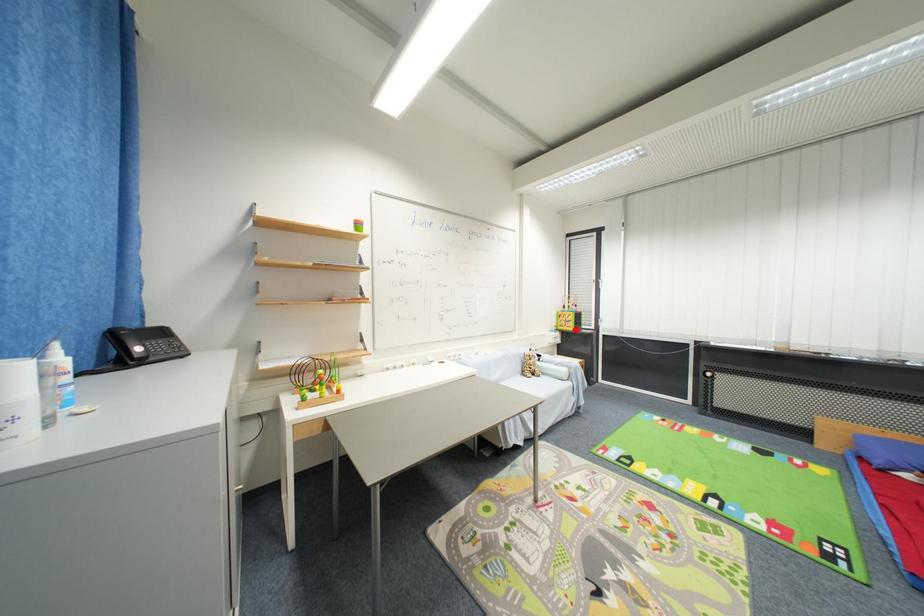
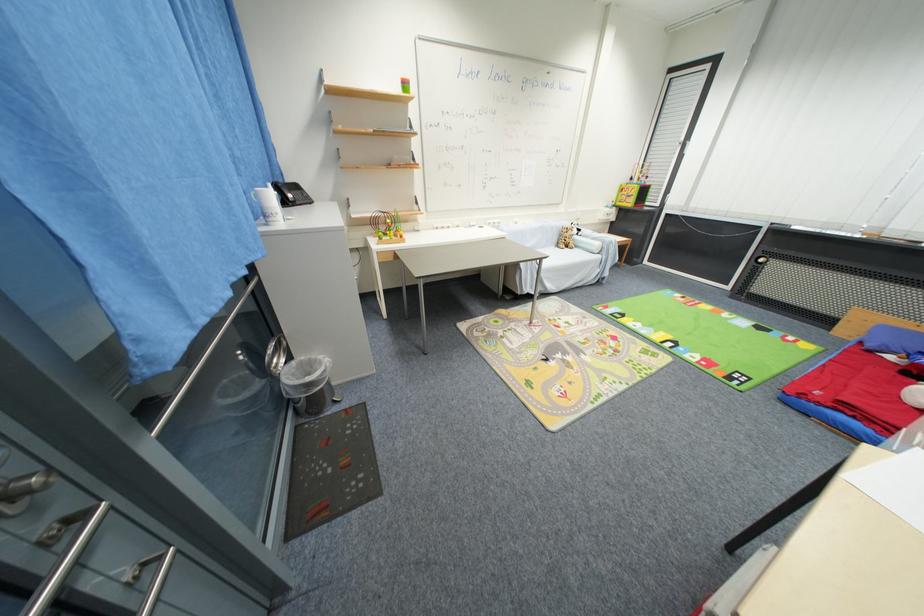
Question: I am providing you with two images of the same scene from different viewpoints. A red point is marked on the first image. At the location where the point appears in image 1, is it still visible in image 2?

Choices:
 (A) Yes
 (B) No

Answer: (A)